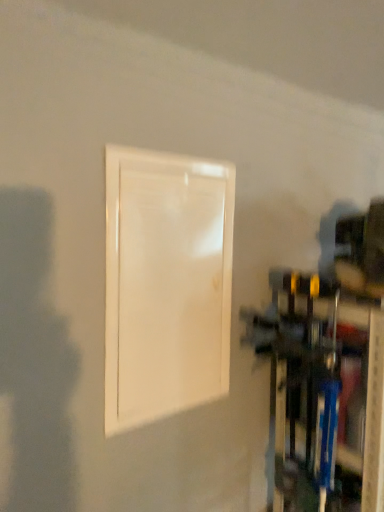
Question: Can you confirm if blue plastic shelf at lower right is bigger than white glossy door at center?

Choices:
 (A) yes
 (B) no

Answer: (A)

Question: Is blue plastic shelf at lower right far from white glossy door at center?

Choices:
 (A) no
 (B) yes

Answer: (A)

Question: Does blue plastic shelf at lower right appear on the right side of white glossy door at center?

Choices:
 (A) no
 (B) yes

Answer: (B)

Question: Is the depth of blue plastic shelf at lower right less than that of white glossy door at center?

Choices:
 (A) yes
 (B) no

Answer: (B)

Question: From a real-world perspective, is blue plastic shelf at lower right below white glossy door at center?

Choices:
 (A) yes
 (B) no

Answer: (A)

Question: Does blue plastic shelf at lower right contain white glossy door at center?

Choices:
 (A) no
 (B) yes

Answer: (A)

Question: Can you see white glossy door at center touching blue plastic shelf at lower right?

Choices:
 (A) yes
 (B) no

Answer: (B)

Question: Considering the relative positions of white glossy door at center and blue plastic shelf at lower right in the image provided, is white glossy door at center to the right of blue plastic shelf at lower right from the viewer's perspective?

Choices:
 (A) yes
 (B) no

Answer: (B)

Question: From the image's perspective, is white glossy door at center beneath blue plastic shelf at lower right?

Choices:
 (A) yes
 (B) no

Answer: (B)

Question: Is white glossy door at center taller than blue plastic shelf at lower right?

Choices:
 (A) no
 (B) yes

Answer: (A)

Question: Is white glossy door at center shorter than blue plastic shelf at lower right?

Choices:
 (A) no
 (B) yes

Answer: (B)

Question: Does white glossy door at center have a larger size compared to blue plastic shelf at lower right?

Choices:
 (A) yes
 (B) no

Answer: (B)

Question: Is white glossy door at center in front of or behind blue plastic shelf at lower right in the image?

Choices:
 (A) behind
 (B) front

Answer: (B)